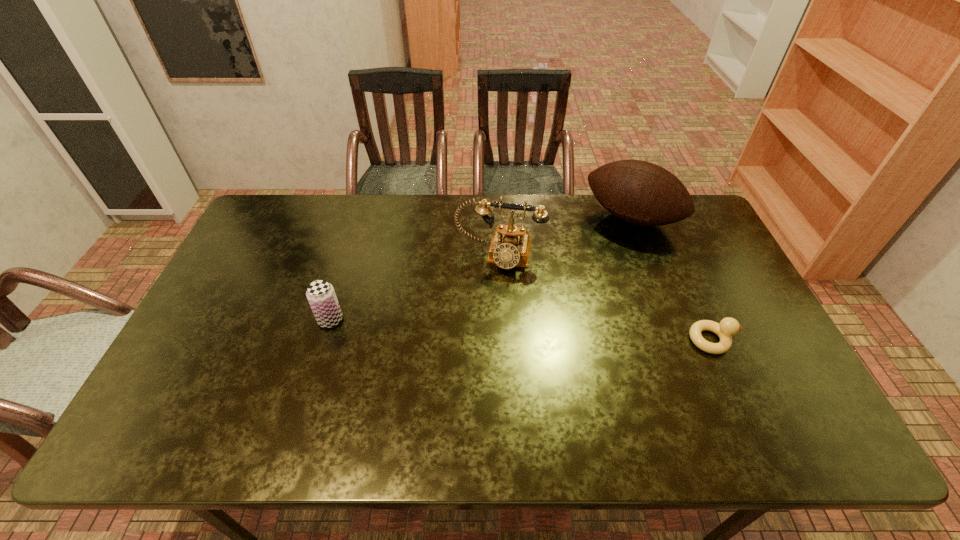
I want to click on vacant area at the right edge, so click(x=766, y=347).

Image resolution: width=960 pixels, height=540 pixels. I want to click on free space at the far left corner of the desktop, so click(x=291, y=199).

Find the location of a particular element. The height and width of the screenshot is (540, 960). vacant space at the near right corner is located at coordinates 756,381.

Find the location of a particular element. unoccupied position between the telephone and the football is located at coordinates (565, 237).

In order to click on free area in between the duckling and the leftmost object in this screenshot , I will do (521, 330).

Where is `vacant space in between the beer can and the football`? The width and height of the screenshot is (960, 540). vacant space in between the beer can and the football is located at coordinates (481, 269).

At what (x,y) coordinates should I click in order to perform the action: click on vacant space that's between the duckling and the second shortest object. Please return your answer as a coordinate pair (x, y). The height and width of the screenshot is (540, 960). Looking at the image, I should click on (521, 330).

Where is `vacant space in between the duckling and the football`? The image size is (960, 540). vacant space in between the duckling and the football is located at coordinates (672, 279).

Find the location of `free spot between the telephone and the leftmost object`. free spot between the telephone and the leftmost object is located at coordinates (415, 288).

At what (x,y) coordinates should I click in order to perform the action: click on blank region between the shortest object and the second object from left to right. Please return your answer as a coordinate pair (x, y). The width and height of the screenshot is (960, 540). Looking at the image, I should click on (606, 298).